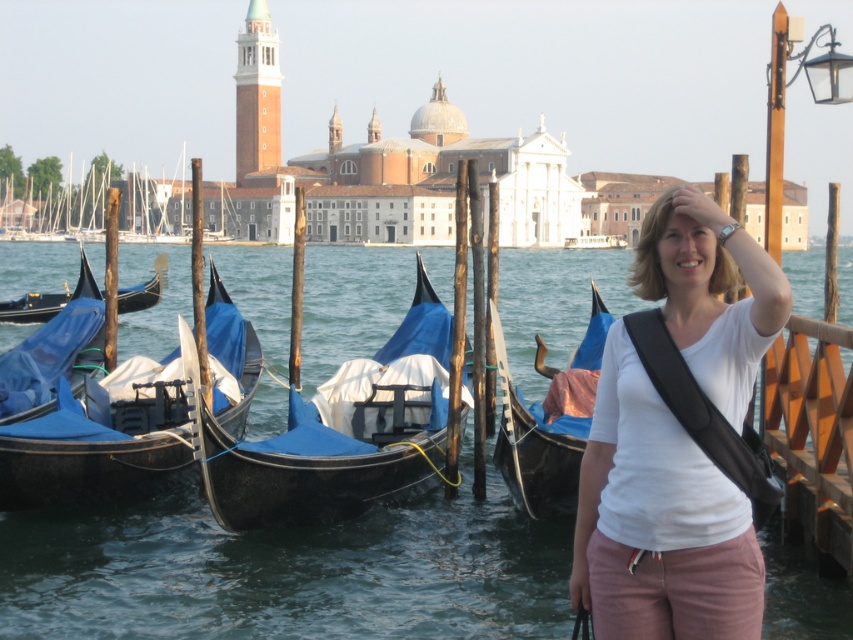
Is transparent water at center above blue fabric gondola at left?

Yes.

Which of these two, transparent water at center or blue fabric gondola at left, stands shorter?

blue fabric gondola at left

From the picture: Who is more distant from viewer, (85, 570) or (109, 464)?

The point (109, 464) is behind.

Locate an element on the screen. Image resolution: width=853 pixels, height=640 pixels. transparent water at center is located at coordinates (288, 572).

Does transparent water at center lie in front of white matte shirt at center?

That is False.

Does transparent water at center lie behind white matte shirt at center?

Yes, it is.

Is point (73, 579) positioned behind point (776, 308)?

That is True.

Find the location of a particular element. transparent water at center is located at coordinates (288, 572).

Which is below, transparent water at center or blue polished wood gondola at left?

Positioned lower is transparent water at center.

Does transparent water at center appear under blue polished wood gondola at left?

Yes, transparent water at center is below blue polished wood gondola at left.

Measure the distance between transparent water at center and camera.

transparent water at center and camera are 53.09 meters apart.

Identify the location of transparent water at center. The height and width of the screenshot is (640, 853). (288, 572).